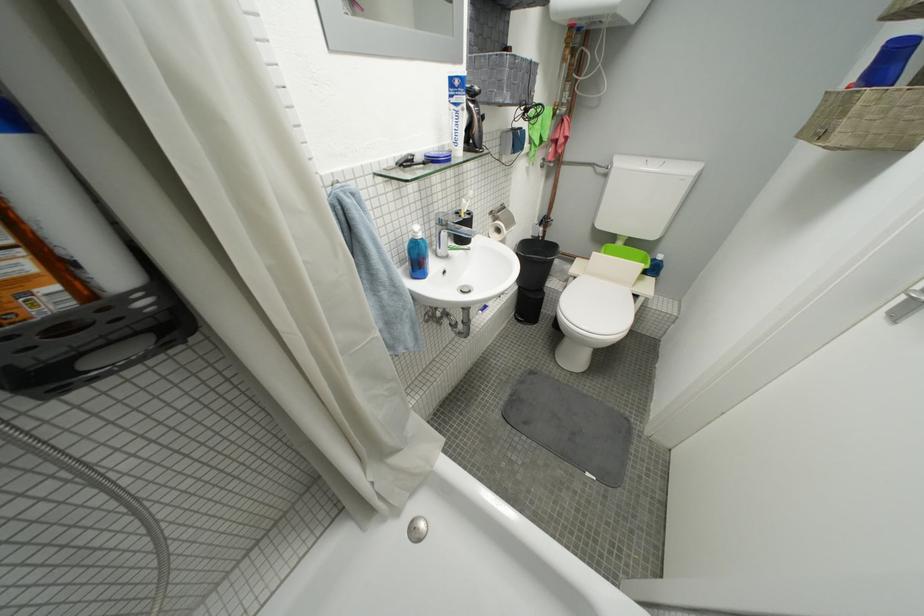
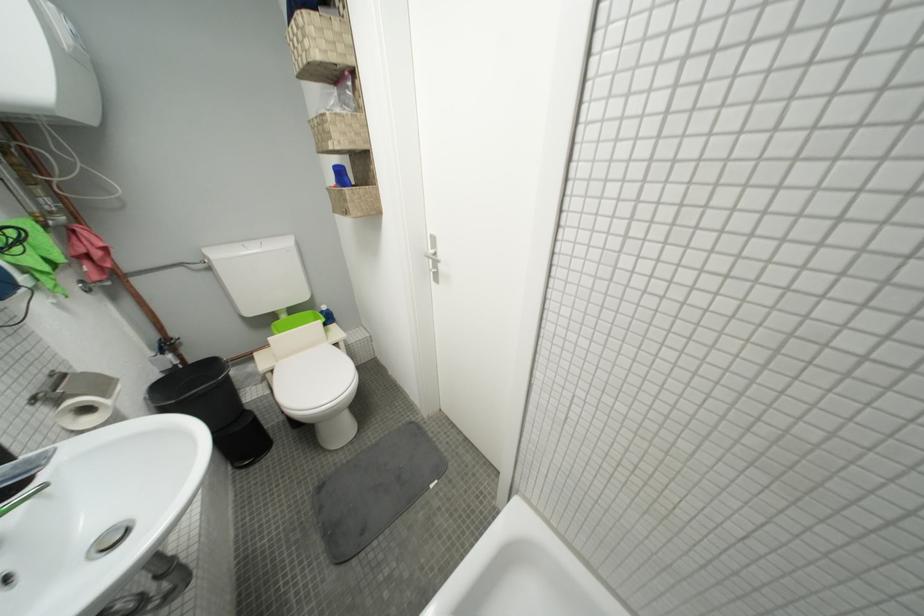
In the second image, find the point that corresponds to pixel 662 169 in the first image.

(262, 252)